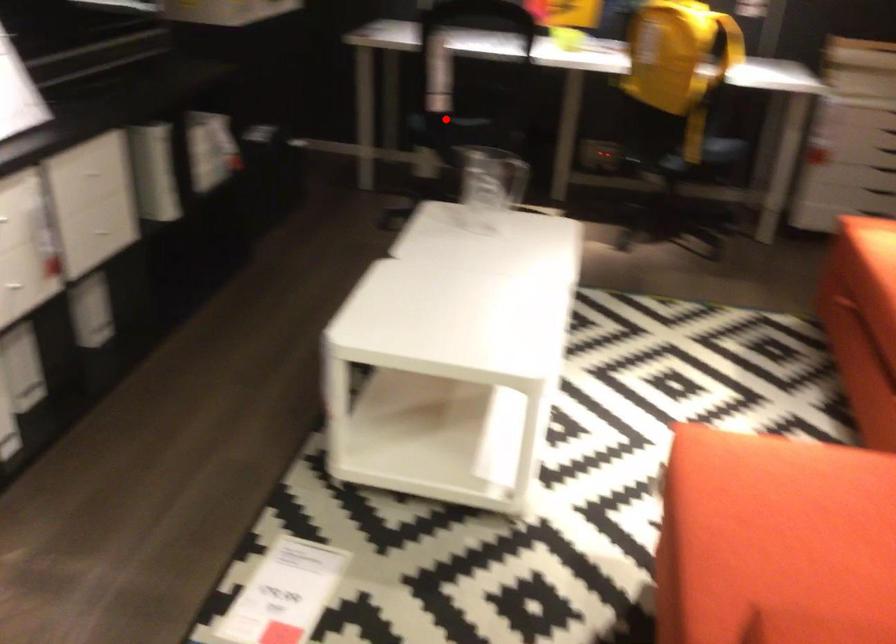
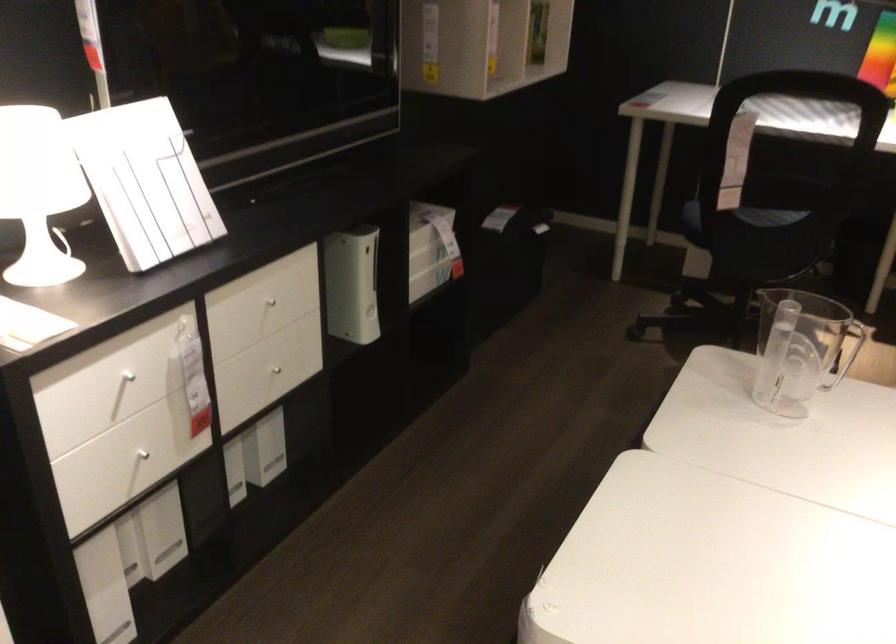
Question: I am providing you with two images of the same scene from different viewpoints. Given a red point in image1, look at the same physical point in image2. Is it:

Choices:
 (A) Closer to the viewpoint
 (B) Farther from the viewpoint

Answer: (A)